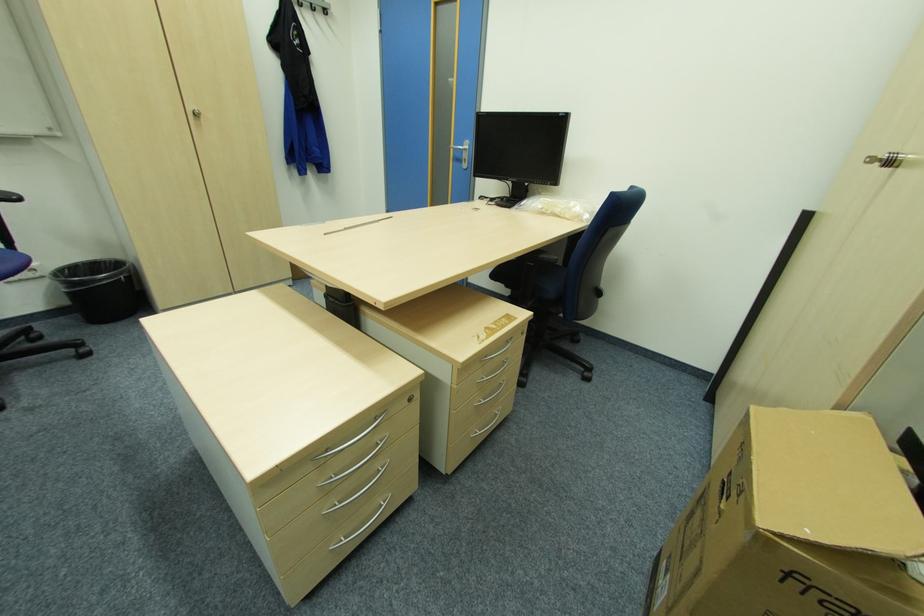
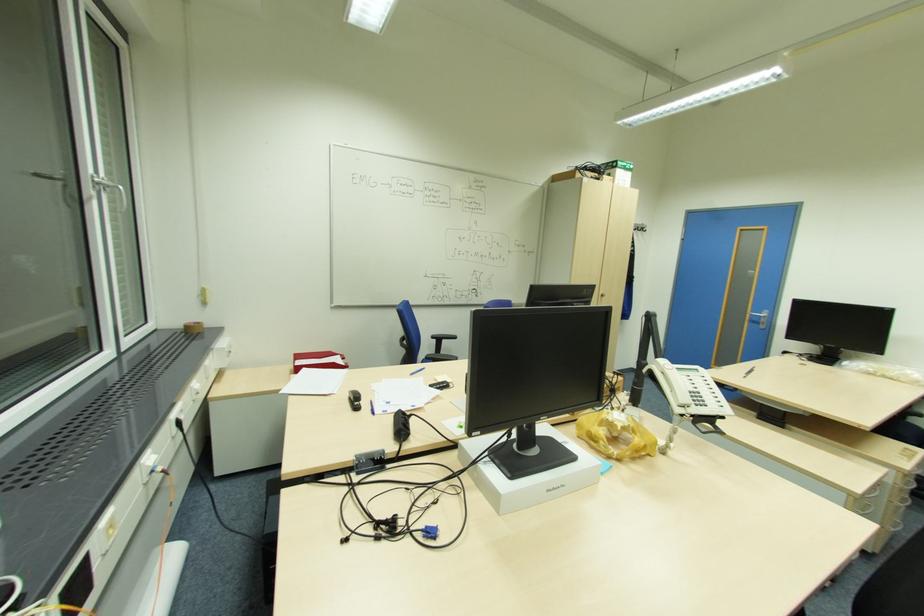
Where in the second image is the point corresponding to point 468,159 from the first image?

(766, 323)